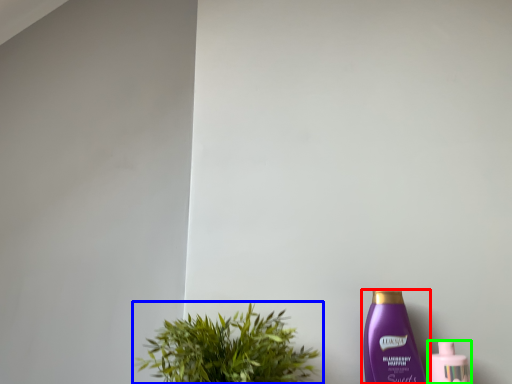
Question: Estimate the real-world distances between objects in this image. Which object is farther from bottle (highlighted by a red box), houseplant (highlighted by a blue box) or bottle (highlighted by a green box)?

Choices:
 (A) houseplant
 (B) bottle

Answer: (A)